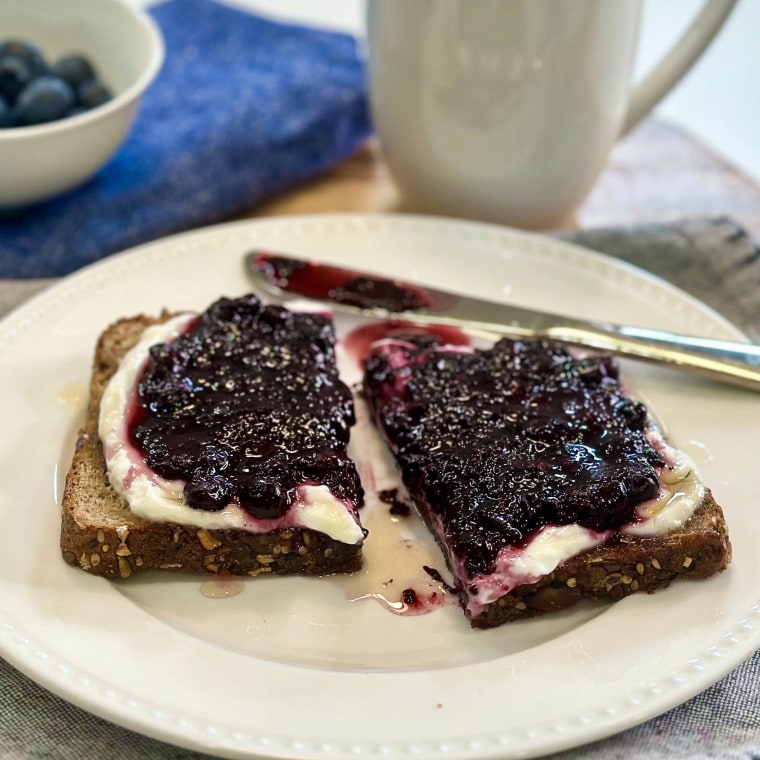
Identify the location of potholder. (160, 128).